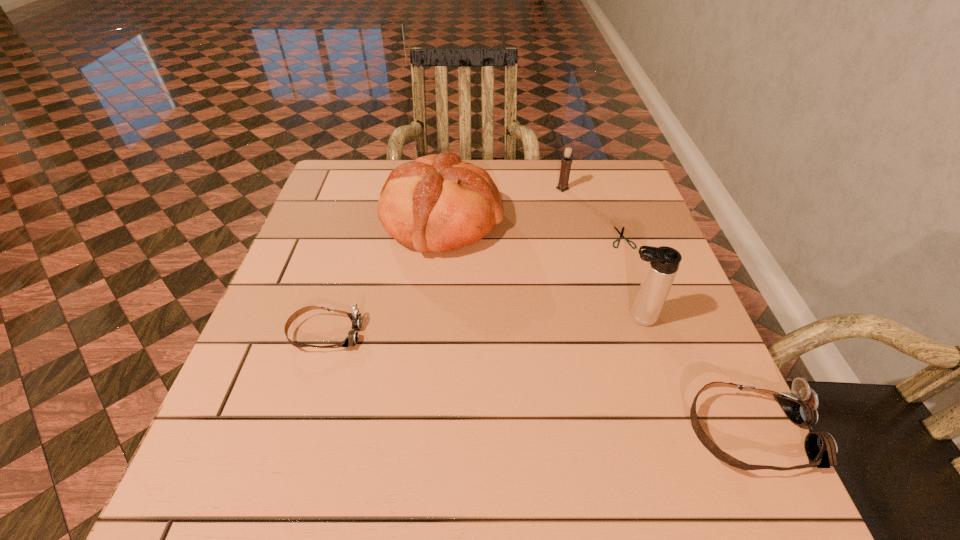
Please determine a free point for an extra goggles to ensure balance. Please provide its 2D coordinates. Your answer should be formatted as a tuple, i.e. [(x, y)], where the tuple contains the x and y coordinates of a point satisfying the conditions above.

[(517, 379)]